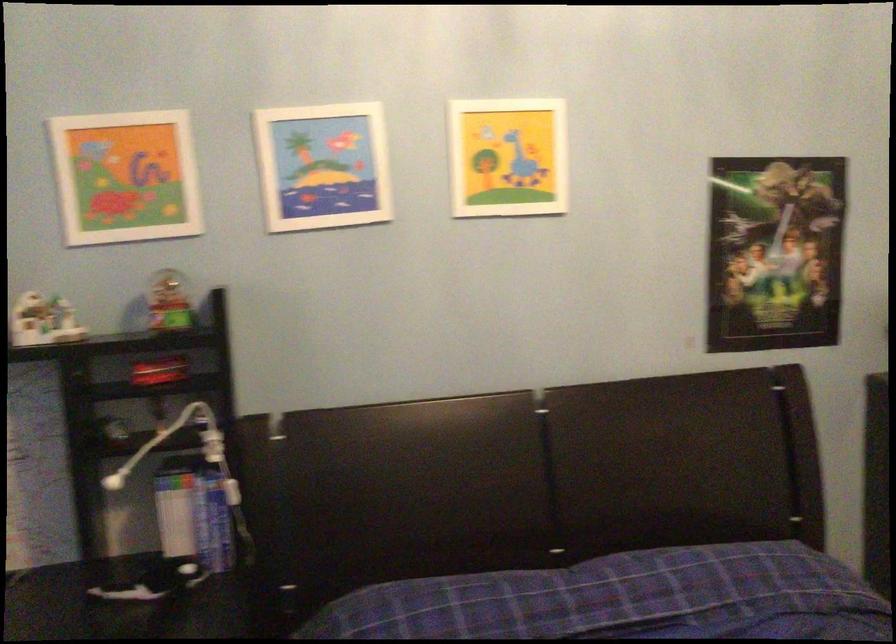
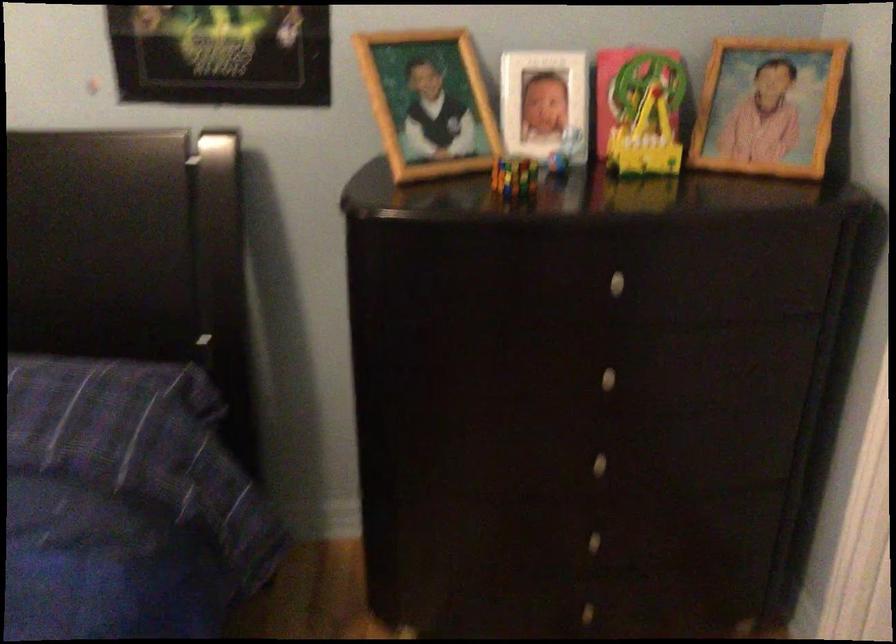
What movement of the cameraman would produce the second image?

The cameraman walked toward right, forward.